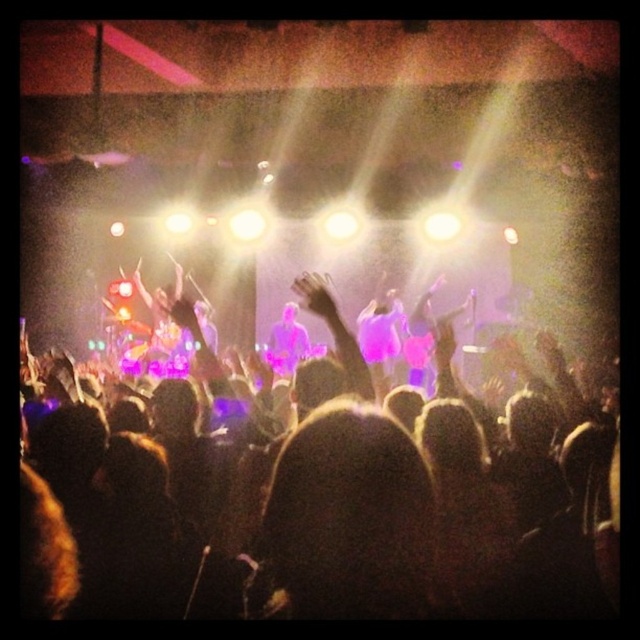
Question: Where is silhouette of person at center located in relation to dark hair at center in the image?

Choices:
 (A) right
 (B) left

Answer: (A)

Question: Can you confirm if silhouette of person at center is wider than dark hair at center?

Choices:
 (A) no
 (B) yes

Answer: (B)

Question: Which point is closer to the camera?

Choices:
 (A) dark hair at center
 (B) silhouette of person at center

Answer: (A)

Question: Is silhouette of person at center below dark hair at center?

Choices:
 (A) no
 (B) yes

Answer: (A)

Question: Among these objects, which one is nearest to the camera?

Choices:
 (A) dark hair at center
 (B) silhouette of person at center

Answer: (A)